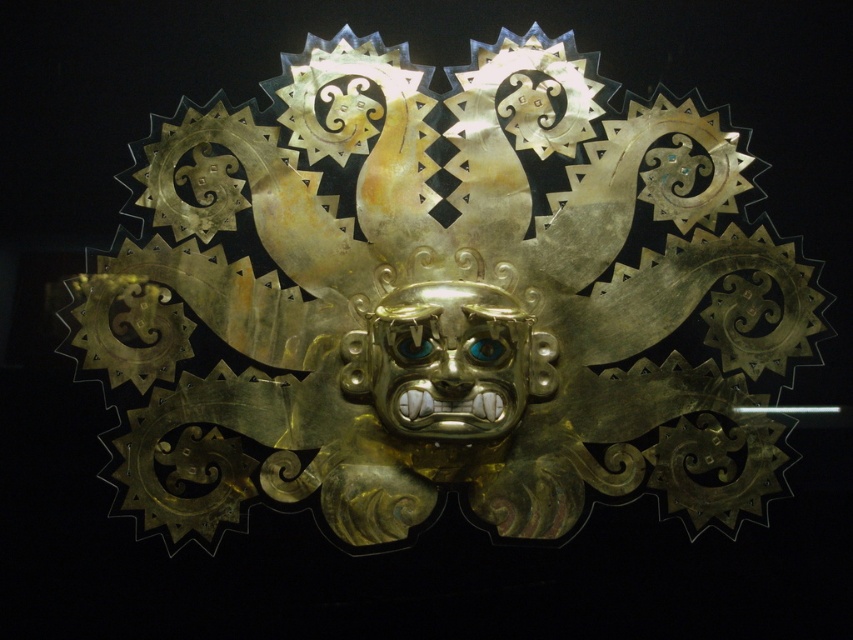
Can you confirm if gold/metallic mask at center is positioned to the right of gold textured mask at center?

Indeed, gold/metallic mask at center is positioned on the right side of gold textured mask at center.

Does point (402, 298) lie in front of point (323, 99)?

Yes.

This screenshot has width=853, height=640. I want to click on gold/metallic mask at center, so click(450, 360).